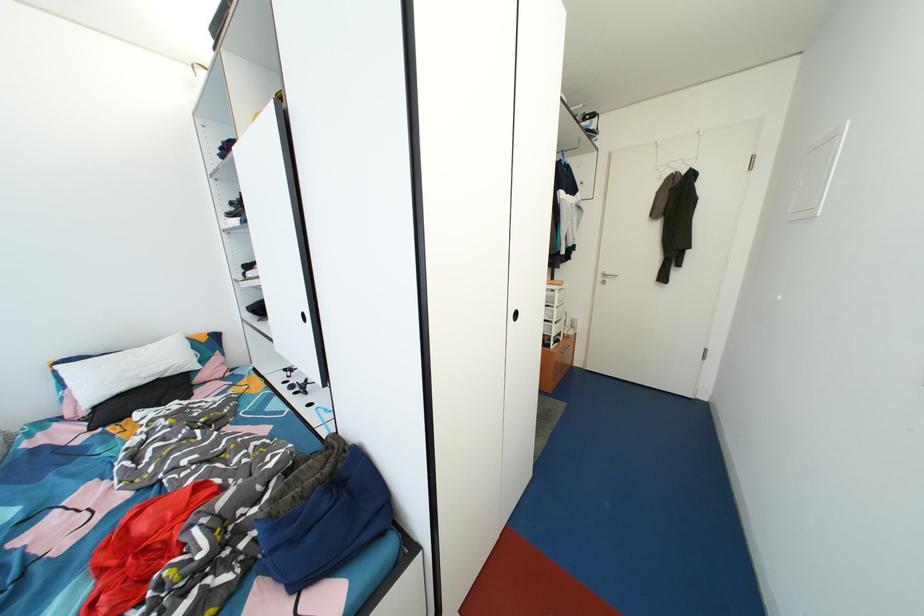
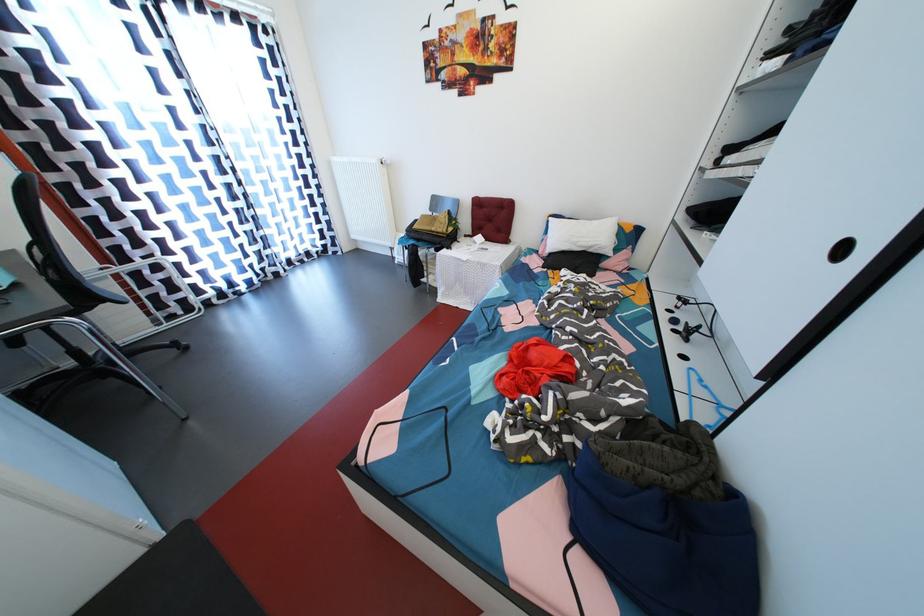
The point at (301,398) is marked in the first image. Where is the corresponding point in the second image?

(681, 336)